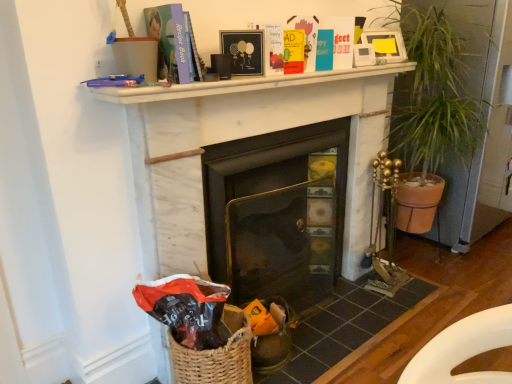
The image size is (512, 384). I want to click on empty space that is to the right of white marble fireplace at center, which appears as the second fireplace when viewed from the left, so click(351, 309).